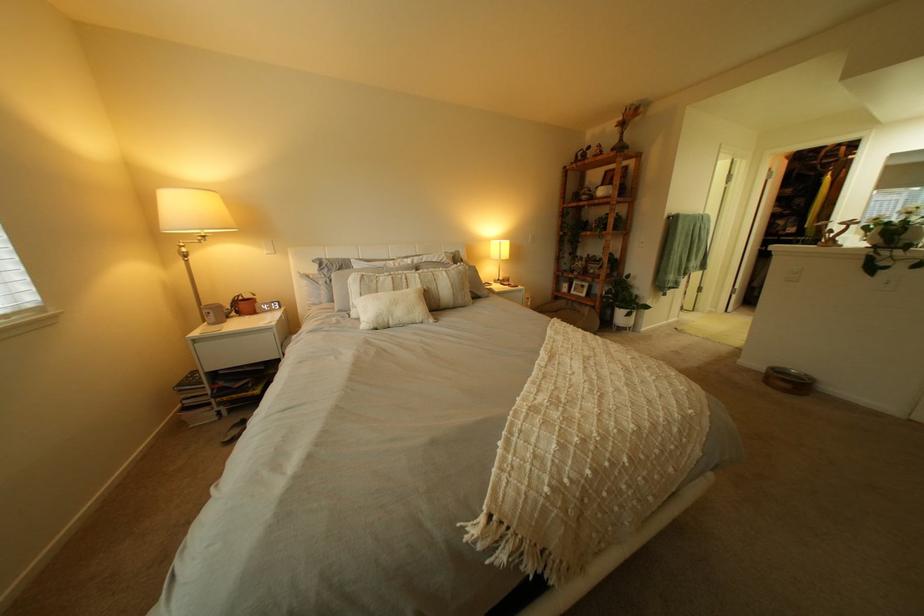
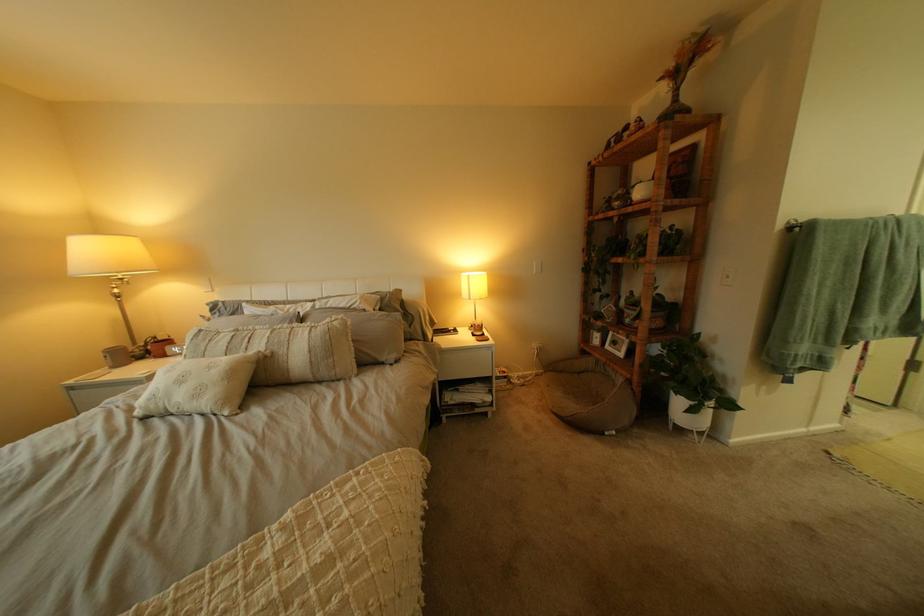
Locate, in the second image, the point that corresponds to the point at 589,293 in the first image.

(623, 347)